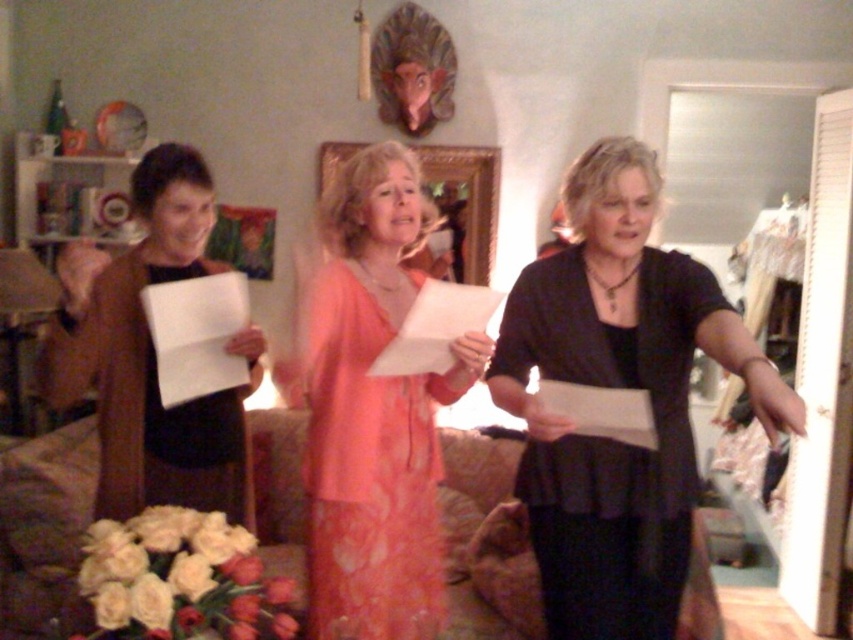
Is black matte dress at center below brown matte cardigan at left?

Indeed, black matte dress at center is positioned under brown matte cardigan at left.

Can you confirm if black matte dress at center is wider than brown matte cardigan at left?

In fact, black matte dress at center might be narrower than brown matte cardigan at left.

Where is `black matte dress at center`? black matte dress at center is located at coordinates (618, 387).

Which of these two, black matte dress at center or matte peach dress at center, stands shorter?

Standing shorter between the two is black matte dress at center.

Does black matte dress at center have a smaller size compared to matte peach dress at center?

No, black matte dress at center is not smaller than matte peach dress at center.

You are a GUI agent. You are given a task and a screenshot of the screen. Output one action in this format:
    pyautogui.click(x=<x>, y=<y>)
    Task: Click on the black matte dress at center
    The image size is (853, 640).
    Given the screenshot: What is the action you would take?
    pyautogui.click(x=618, y=387)

Does matte peach dress at center have a greater width compared to brown matte cardigan at left?

In fact, matte peach dress at center might be narrower than brown matte cardigan at left.

The width and height of the screenshot is (853, 640). What do you see at coordinates (373, 412) in the screenshot? I see `matte peach dress at center` at bounding box center [373, 412].

You are a GUI agent. You are given a task and a screenshot of the screen. Output one action in this format:
    pyautogui.click(x=<x>, y=<y>)
    Task: Click on the matte peach dress at center
    The height and width of the screenshot is (640, 853).
    Given the screenshot: What is the action you would take?
    pyautogui.click(x=373, y=412)